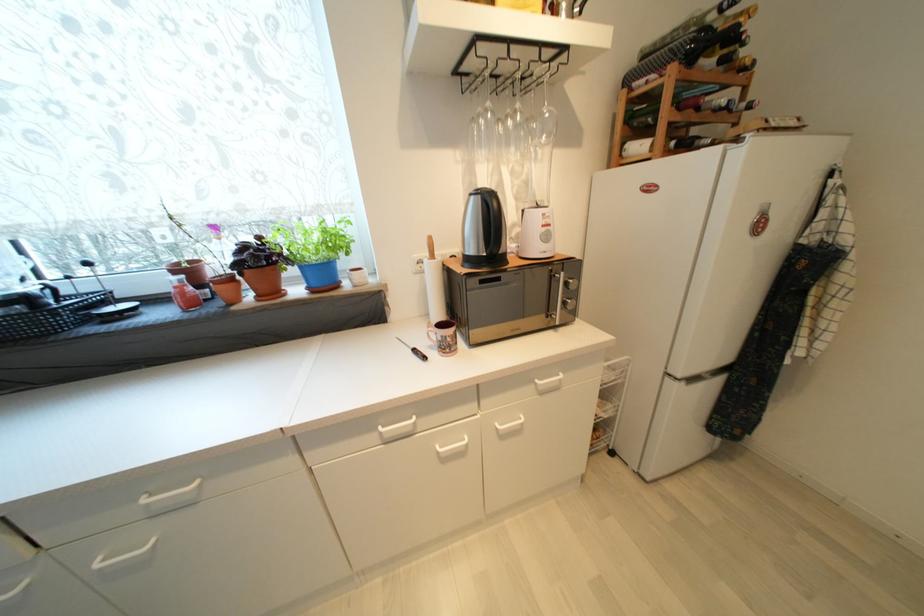
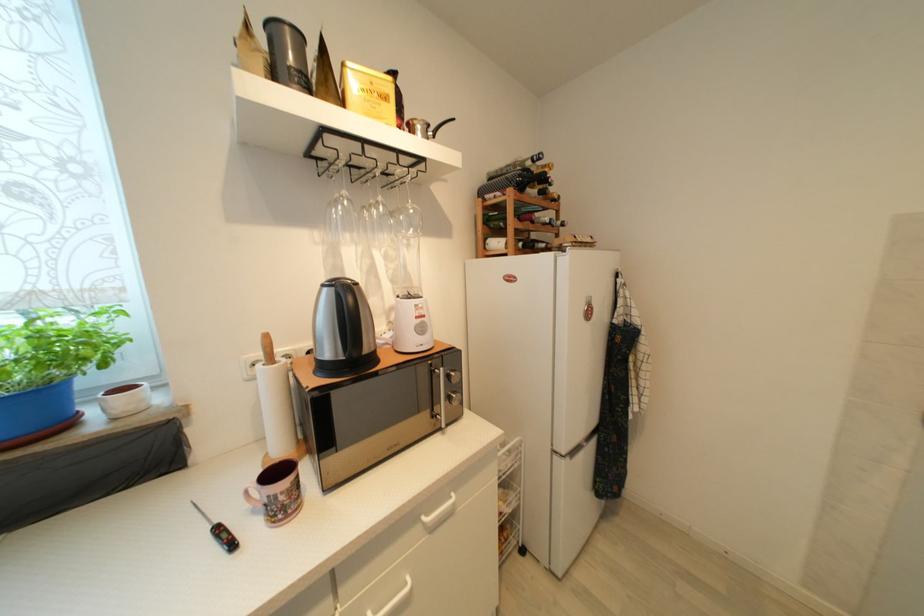
The images are taken continuously from a first-person perspective. In which direction are you moving?

The cameraman walked toward right, forward.